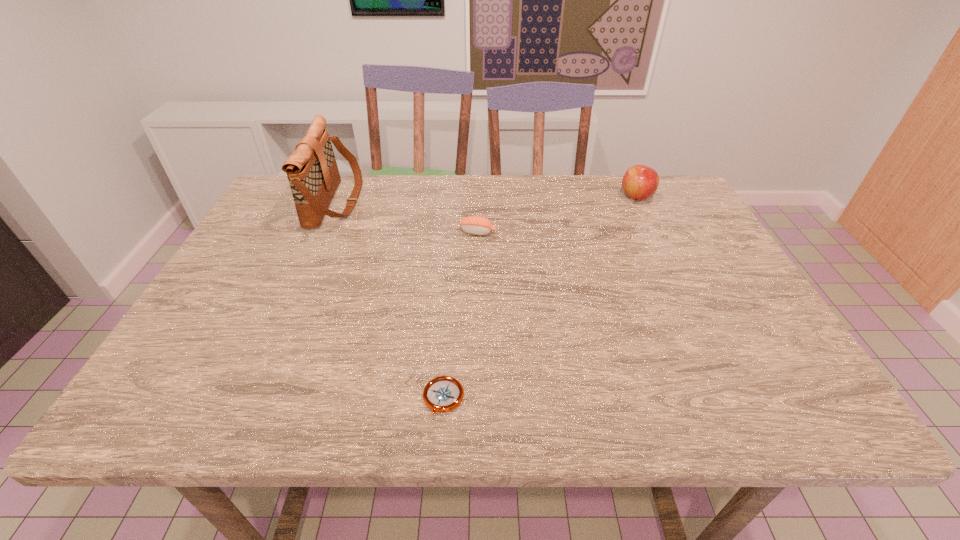
Where is `free location located on the right of the compass`? The height and width of the screenshot is (540, 960). free location located on the right of the compass is located at coordinates (647, 399).

Where is `shoulder bag positioned at the far edge`? The height and width of the screenshot is (540, 960). shoulder bag positioned at the far edge is located at coordinates (312, 171).

The image size is (960, 540). In order to click on apple that is at the far edge in this screenshot , I will do `click(640, 182)`.

This screenshot has width=960, height=540. Identify the location of object present at the near edge. (442, 394).

This screenshot has width=960, height=540. What are the coordinates of `object that is at the left edge` in the screenshot? It's located at (312, 171).

At what (x,y) coordinates should I click in order to perform the action: click on object present at the right edge. Please return your answer as a coordinate pair (x, y). This screenshot has width=960, height=540. Looking at the image, I should click on (640, 182).

Locate an element on the screen. object present at the far left corner is located at coordinates (312, 171).

The width and height of the screenshot is (960, 540). What are the coordinates of `object present at the far right corner` in the screenshot? It's located at (640, 182).

This screenshot has height=540, width=960. Find the location of `vacant space at the far edge of the desktop`. vacant space at the far edge of the desktop is located at coordinates (378, 179).

Find the location of a particular element. Image resolution: width=960 pixels, height=540 pixels. vacant space at the left edge of the desktop is located at coordinates 303,233.